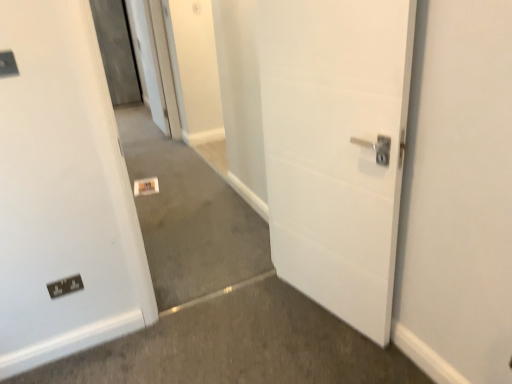
Question: Is neutral carpet at center positioned in front of black plastic electric outlet at lower left?

Choices:
 (A) yes
 (B) no

Answer: (A)

Question: Are neutral carpet at center and black plastic electric outlet at lower left located far from each other?

Choices:
 (A) no
 (B) yes

Answer: (B)

Question: Would you say neutral carpet at center contains black plastic electric outlet at lower left?

Choices:
 (A) yes
 (B) no

Answer: (B)

Question: From a real-world perspective, is neutral carpet at center located beneath black plastic electric outlet at lower left?

Choices:
 (A) yes
 (B) no

Answer: (B)

Question: Could you tell me if neutral carpet at center is turned towards black plastic electric outlet at lower left?

Choices:
 (A) yes
 (B) no

Answer: (B)

Question: Is black plastic electric outlet at lower left taller or shorter than matte black switch at upper left?

Choices:
 (A) tall
 (B) short

Answer: (A)

Question: From the image's perspective, relative to matte black switch at upper left, is black plastic electric outlet at lower left above or below?

Choices:
 (A) below
 (B) above

Answer: (A)

Question: Is black plastic electric outlet at lower left inside or outside of matte black switch at upper left?

Choices:
 (A) outside
 (B) inside

Answer: (A)

Question: Based on their sizes in the image, would you say black plastic electric outlet at lower left is bigger or smaller than matte black switch at upper left?

Choices:
 (A) small
 (B) big

Answer: (B)

Question: In terms of size, does matte black switch at upper left appear bigger or smaller than neutral carpet at center?

Choices:
 (A) small
 (B) big

Answer: (A)

Question: From their relative heights in the image, would you say matte black switch at upper left is taller or shorter than neutral carpet at center?

Choices:
 (A) short
 (B) tall

Answer: (A)

Question: From a real-world perspective, relative to neutral carpet at center, is matte black switch at upper left vertically above or below?

Choices:
 (A) below
 (B) above

Answer: (B)

Question: Visually, is matte black switch at upper left positioned to the left or to the right of neutral carpet at center?

Choices:
 (A) right
 (B) left

Answer: (B)

Question: Visually, is matte black switch at upper left positioned to the left or to the right of black plastic electric outlet at lower left?

Choices:
 (A) left
 (B) right

Answer: (A)

Question: In terms of height, does matte black switch at upper left look taller or shorter compared to black plastic electric outlet at lower left?

Choices:
 (A) tall
 (B) short

Answer: (B)